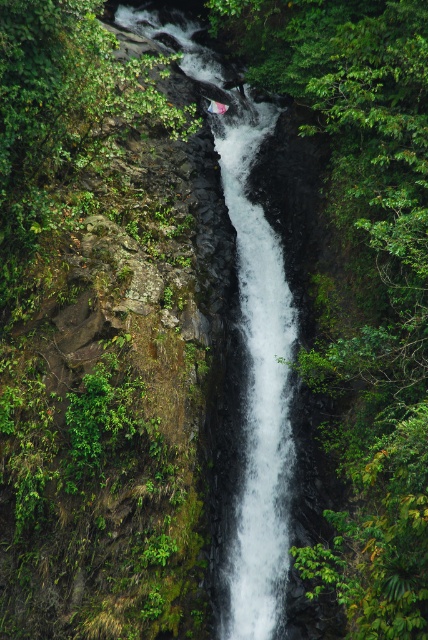
Question: Where is white frothy water at center located in relation to white smooth waterfall at center in the image?

Choices:
 (A) below
 (B) above

Answer: (B)

Question: Is white frothy water at center closer to the viewer compared to white smooth waterfall at center?

Choices:
 (A) no
 (B) yes

Answer: (A)

Question: Is white frothy water at center thinner than white smooth waterfall at center?

Choices:
 (A) no
 (B) yes

Answer: (A)

Question: Among these points, which one is nearest to the camera?

Choices:
 (A) (267, 552)
 (B) (272, 540)

Answer: (A)